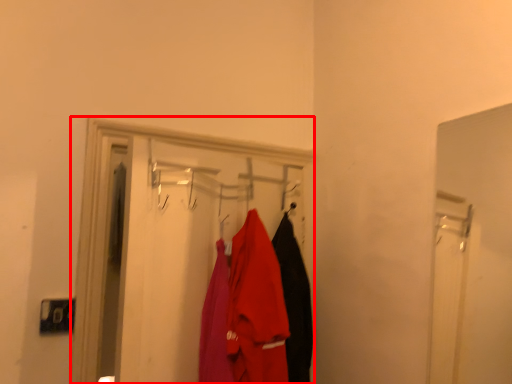
Question: Considering the relative positions of closet (annotated by the red box) and clothing in the image provided, where is closet (annotated by the red box) located with respect to the staircase?

Choices:
 (A) left
 (B) right

Answer: (A)